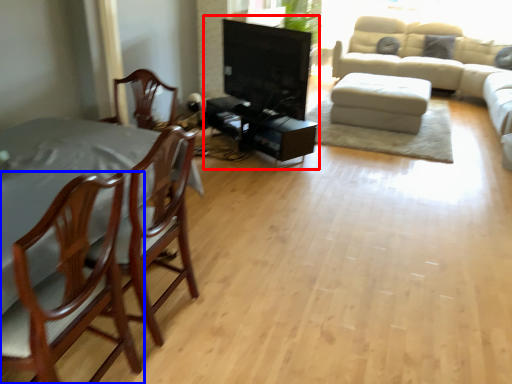
Question: Which of the following is the farthest to the observer, entertainment center (highlighted by a red box) or chair (highlighted by a blue box)?

Choices:
 (A) entertainment center
 (B) chair

Answer: (A)